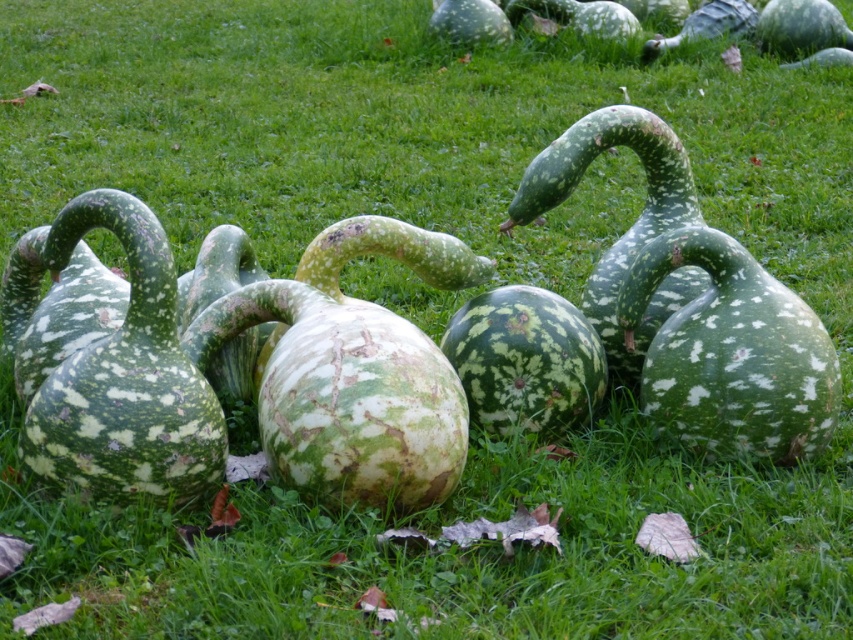
Which is behind, point (103, 195) or point (602, 365)?

The point (602, 365) is behind.

Between speckled green gourd at left and green spotted gourd at center, which one is positioned higher?

speckled green gourd at left is higher up.

Between point (146, 253) and point (524, 369), which one is positioned behind?

The point (524, 369) is more distant.

I want to click on speckled green gourd at left, so click(122, 372).

In the scene shown: Does speckled green gourd at left have a lesser width compared to speckled green gourd at center-right?

No.

Based on the photo, does speckled green gourd at left appear on the left side of speckled green gourd at center-right?

Indeed, speckled green gourd at left is positioned on the left side of speckled green gourd at center-right.

The height and width of the screenshot is (640, 853). Identify the location of speckled green gourd at left. (122, 372).

This screenshot has width=853, height=640. Identify the location of speckled green gourd at left. (122, 372).

Who is more forward, [753,428] or [512,385]?

Point [753,428] is more forward.

Between point (799, 387) and point (576, 381), which one is positioned behind?

The point (576, 381) is behind.

Find the location of a particular element. The height and width of the screenshot is (640, 853). speckled green gourd at center-right is located at coordinates (730, 353).